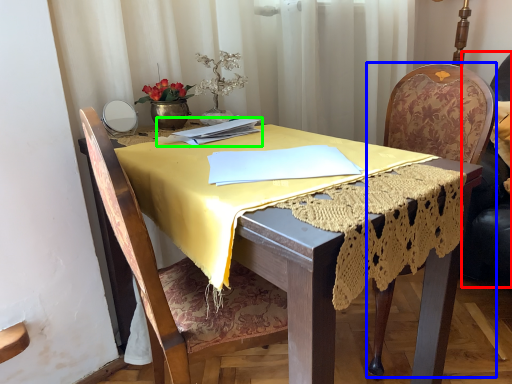
Question: Estimate the real-world distances between objects in this image. Which object is farther from swivel chair (highlighted by a red box), chair (highlighted by a blue box) or notebook (highlighted by a green box)?

Choices:
 (A) chair
 (B) notebook

Answer: (B)